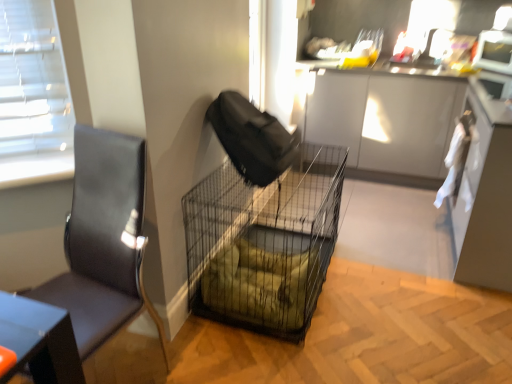
The image size is (512, 384). What are the coordinates of `vacant area in front of black wire mesh cage at center` in the screenshot? It's located at (285, 350).